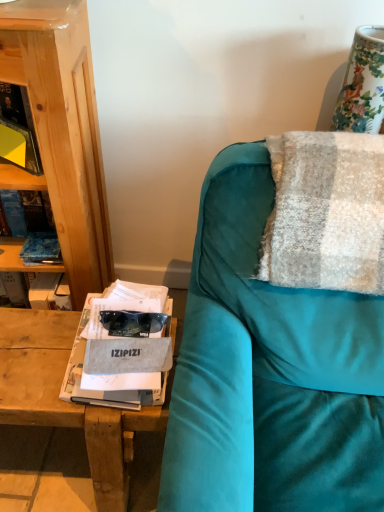
Question: Should I look upward or downward to see gray fabric magazine at left?

Choices:
 (A) up
 (B) down

Answer: (B)

Question: Considering the relative sizes of textured woolen blanket at right and gray fabric magazine at left in the image provided, is textured woolen blanket at right bigger than gray fabric magazine at left?

Choices:
 (A) no
 (B) yes

Answer: (B)

Question: Does textured woolen blanket at right have a lesser height compared to gray fabric magazine at left?

Choices:
 (A) yes
 (B) no

Answer: (B)

Question: Is gray fabric magazine at left at the back of textured woolen blanket at right?

Choices:
 (A) yes
 (B) no

Answer: (B)

Question: Can you confirm if textured woolen blanket at right is positioned to the left of gray fabric magazine at left?

Choices:
 (A) no
 (B) yes

Answer: (A)

Question: Is textured woolen blanket at right far from gray fabric magazine at left?

Choices:
 (A) yes
 (B) no

Answer: (B)

Question: Considering the relative sizes of textured woolen blanket at right and gray fabric magazine at left in the image provided, is textured woolen blanket at right taller than gray fabric magazine at left?

Choices:
 (A) yes
 (B) no

Answer: (A)

Question: Can you confirm if porcelain floral vase at upper right is positioned to the left of textured woolen blanket at right?

Choices:
 (A) no
 (B) yes

Answer: (A)

Question: From a real-world perspective, is porcelain floral vase at upper right located higher than textured woolen blanket at right?

Choices:
 (A) yes
 (B) no

Answer: (A)

Question: Can you confirm if porcelain floral vase at upper right is smaller than textured woolen blanket at right?

Choices:
 (A) yes
 (B) no

Answer: (A)

Question: Does porcelain floral vase at upper right come behind textured woolen blanket at right?

Choices:
 (A) yes
 (B) no

Answer: (A)

Question: Would you say porcelain floral vase at upper right is a long distance from textured woolen blanket at right?

Choices:
 (A) no
 (B) yes

Answer: (A)

Question: Does porcelain floral vase at upper right have a larger size compared to textured woolen blanket at right?

Choices:
 (A) yes
 (B) no

Answer: (B)

Question: Considering the relative positions of gray fabric magazine at left and porcelain floral vase at upper right in the image provided, is gray fabric magazine at left to the left of porcelain floral vase at upper right from the viewer's perspective?

Choices:
 (A) no
 (B) yes

Answer: (B)